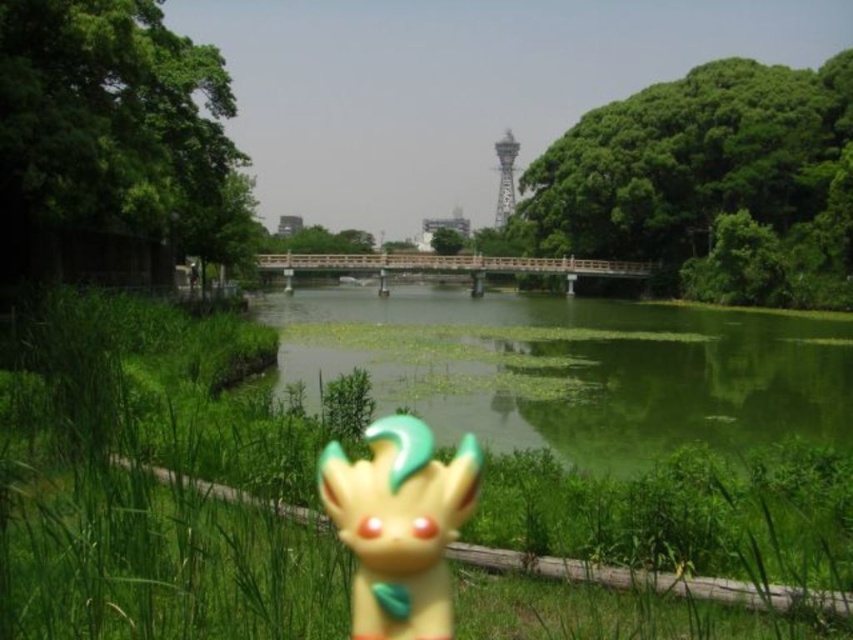
Is green matte grass at center shorter than metallic silver tower at center?

Indeed, green matte grass at center has a lesser height compared to metallic silver tower at center.

Is point (109, 564) positioned behind point (514, 148)?

That is False.

Locate an element on the screen. green matte grass at center is located at coordinates 438,454.

Who is more forward, (88, 344) or (714, 326)?

Point (88, 344) is more forward.

Is green matte grass at center taller than green grassy river at center?

In fact, green matte grass at center may be shorter than green grassy river at center.

This screenshot has height=640, width=853. Identify the location of green matte grass at center. (438, 454).

Which is below, green matte grass at center or yellow matte figurine at center?

Positioned lower is yellow matte figurine at center.

This screenshot has height=640, width=853. I want to click on green matte grass at center, so click(438, 454).

I want to click on green matte grass at center, so click(x=438, y=454).